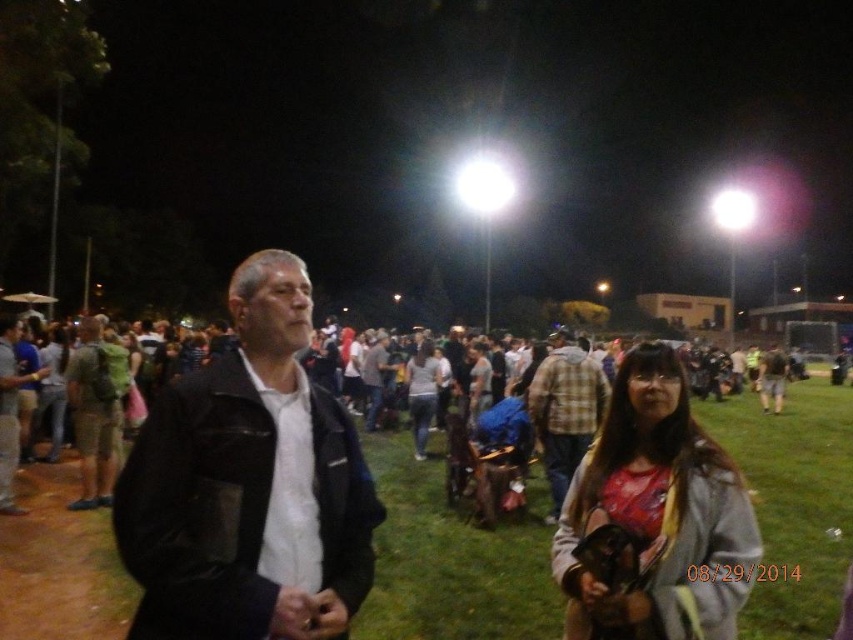
Question: Where is plaid fabric shirt at center located in relation to denim jeans at center in the image?

Choices:
 (A) left
 (B) right

Answer: (B)

Question: Which object is the closest to the matte red shirt at center?

Choices:
 (A) plaid fabric shirt at center
 (B) black leather jacket at center

Answer: (B)

Question: Does black leather jacket at center lie in front of matte gray shirt at center?

Choices:
 (A) no
 (B) yes

Answer: (B)

Question: Which of the following is the farthest from the observer?

Choices:
 (A) plaid fabric shirt at center
 (B) matte red shirt at center

Answer: (A)

Question: Estimate the real-world distances between objects in this image. Which object is closer to the plaid fabric shirt at center?

Choices:
 (A) matte gray shirt at center
 (B) black leather jacket at center
 (C) denim jeans at center

Answer: (C)

Question: Is black leather jacket at center wider than plaid fabric shirt at center?

Choices:
 (A) no
 (B) yes

Answer: (A)